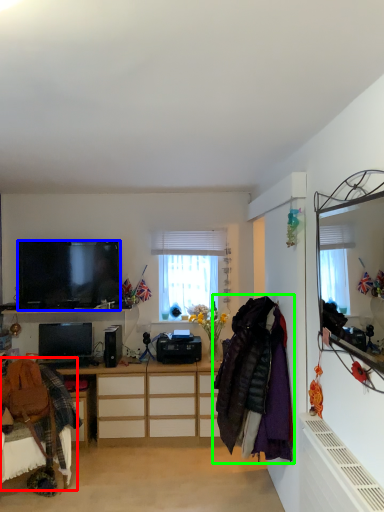
Question: Which object is positioned closest to swivel chair (highlighted by a red box)? Select from television (highlighted by a blue box) and clothing (highlighted by a green box).

Choices:
 (A) television
 (B) clothing

Answer: (A)